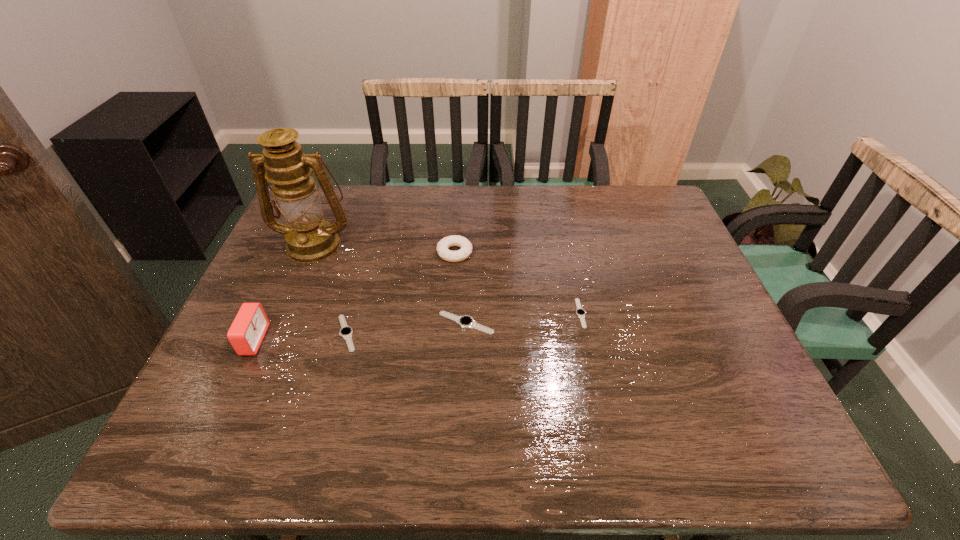
The height and width of the screenshot is (540, 960). In order to click on free space between the fourth tallest object and the alarm clock in this screenshot , I will do (360, 332).

Where is `vacant space that is in between the fifth shortest object and the doughnut`? The width and height of the screenshot is (960, 540). vacant space that is in between the fifth shortest object and the doughnut is located at coordinates (354, 296).

Find the location of a particular element. The image size is (960, 540). free space between the oil lamp and the second watch from left to right is located at coordinates (391, 284).

Where is `object that is the second closest to the shortest object`? This screenshot has width=960, height=540. object that is the second closest to the shortest object is located at coordinates (454, 240).

Where is `object that is the fourth closest to the second watch from right to left`? The image size is (960, 540). object that is the fourth closest to the second watch from right to left is located at coordinates (309, 238).

This screenshot has width=960, height=540. I want to click on the closest watch to the rightmost object, so click(466, 321).

Identify which watch is the closest to the tallest watch. Please provide its 2D coordinates. Your answer should be formatted as a tuple, i.e. [(x, y)], where the tuple contains the x and y coordinates of a point satisfying the conditions above.

[(346, 332)]

You are a GUI agent. You are given a task and a screenshot of the screen. Output one action in this format:
    pyautogui.click(x=<x>, y=<y>)
    Task: Click on the free location that satisfies the following two spatial constraints: 1. on the front side of the tallest object; 2. on the front-facing side of the second tallest object
    
    Given the screenshot: What is the action you would take?
    pyautogui.click(x=275, y=340)

The width and height of the screenshot is (960, 540). What are the coordinates of `free location that satisfies the following two spatial constraints: 1. on the front side of the leftmost watch; 2. on the front-facing side of the alarm clock` in the screenshot? It's located at (345, 340).

This screenshot has height=540, width=960. Identify the location of free spot that satisfies the following two spatial constraints: 1. on the back side of the rightmost watch; 2. on the left side of the second watch from left to right. (467, 313).